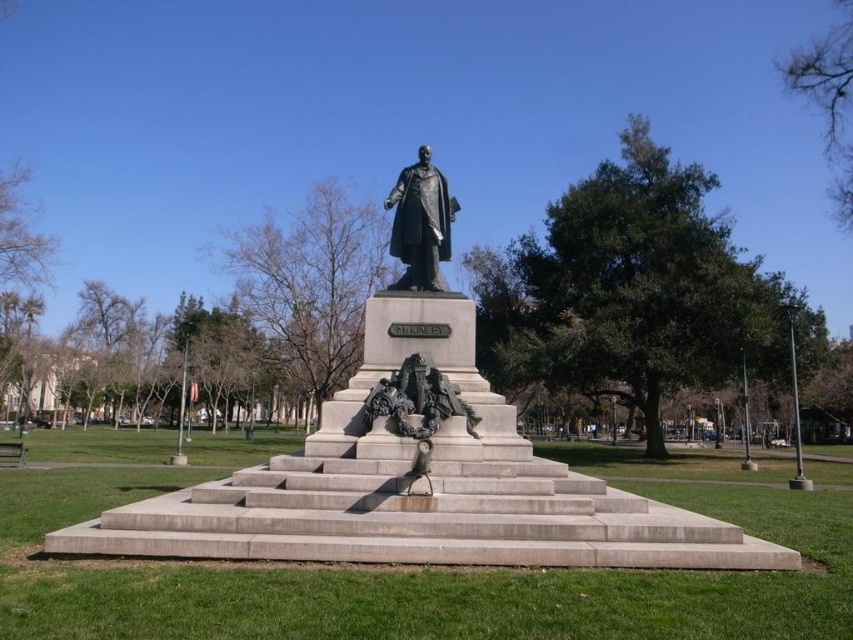
You are standing at the camera position looking at the statue. A maintenance worker needs to reach a point located at coordinates point [418,227]. If the worker has a telescoping pole that extends up to 10 meters, can they reach that point without moving closer?

The distance between point [418,227] and the camera is 10.30 meters. Since the telescoping pole only extends up to 10 meters, the worker cannot reach the point without moving closer.

You are a park visitor who wants to take a photo of both the bronze statue at center and the bronze dragon at center. Since you want both to be clearly visible in the same frame, which object should you focus on to ensure both are in focus?

The bronze statue at center has a lesser width compared to bronze dragon at center. Therefore, you should focus on the bronze dragon at center because it is larger and will be easier to keep in focus while the smaller bronze statue at center will also be in focus due to its proximity in the same focal plane.

You are standing at point 0.5, 0.5 in the park. You want to go to the bronze statue at center. Which direction should you go?

You should go west because the bronze statue at center is located at point (421,224), which is west of your current position at (426,320).